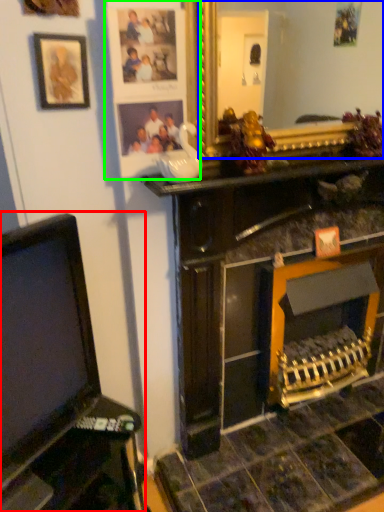
Question: Considering the real-world distances, which object is farthest from furniture (highlighted by a red box)? mirror (highlighted by a blue box) or picture frame (highlighted by a green box)?

Choices:
 (A) mirror
 (B) picture frame

Answer: (A)